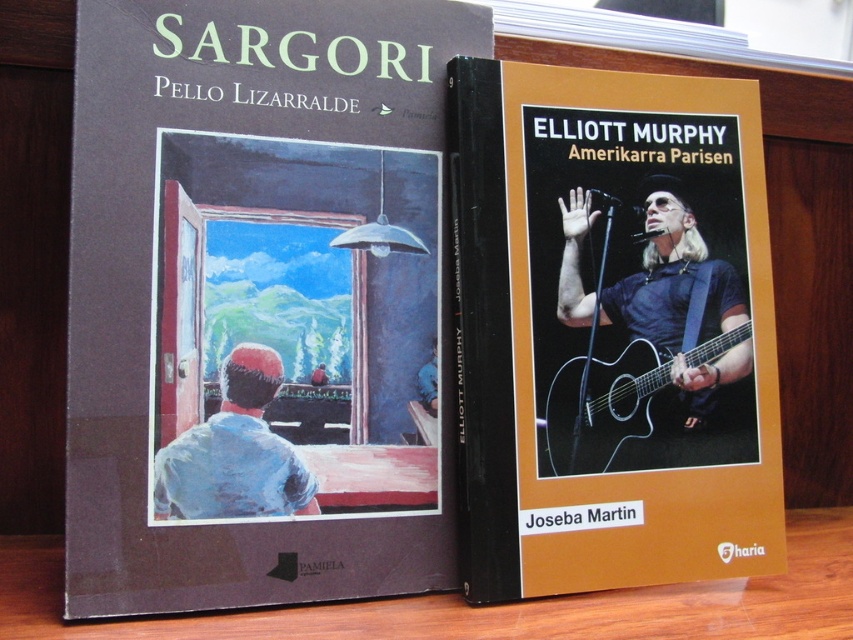
You are organizing a music room and need to move the matte black guitar at center and the acoustic wood guitar at center to different shelves. If you want to place one closer to the front of the shelf, which guitar should you choose?

The matte black guitar at center is already in front of the acoustic wood guitar at center, so you should choose the matte black guitar at center to place closer to the front of the shelf.

You are organizing a small display on a shelf and have a matte brown book cover at left and a matte black guitar at center. The shelf has a width of 6 inches. Can both items fit side by side on the shelf without overlapping?

The matte brown book cover at left and matte black guitar at center are 5.63 inches apart, so they can fit on a 6 inch shelf since the total width required is less than the shelf width.